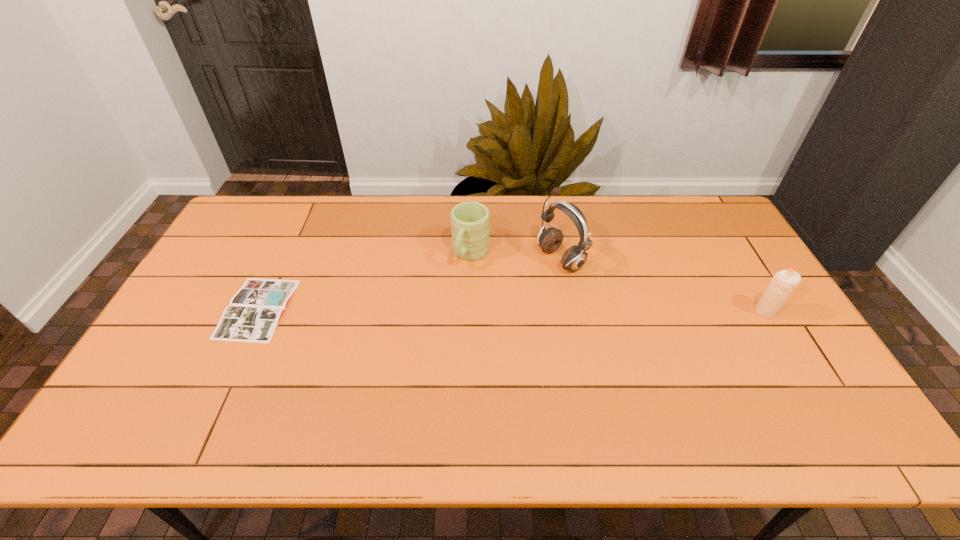
In order to click on free space located on the ear pads of the tallest object in this screenshot , I will do `click(505, 290)`.

At what (x,y) coordinates should I click in order to perform the action: click on blank area located 0.300m on the ear pads of the tallest object. Please return your answer as a coordinate pair (x, y). Image resolution: width=960 pixels, height=540 pixels. Looking at the image, I should click on (464, 312).

Identify the location of free space located 0.210m on the ear pads of the tallest object. (489, 299).

Locate an element on the screen. vacant space located on the side of the second shortest object with the handle is located at coordinates (434, 326).

Locate an element on the screen. blank area located on the side of the second shortest object with the handle is located at coordinates (443, 310).

Find the location of a particular element. This screenshot has width=960, height=540. free point located on the side of the second shortest object with the handle is located at coordinates (457, 285).

You are a GUI agent. You are given a task and a screenshot of the screen. Output one action in this format:
    pyautogui.click(x=<x>, y=<y>)
    Task: Click on the object that is at the left edge
    
    Given the screenshot: What is the action you would take?
    pos(254,312)

The width and height of the screenshot is (960, 540). Find the location of `object that is at the right edge`. object that is at the right edge is located at coordinates (782, 284).

Image resolution: width=960 pixels, height=540 pixels. I want to click on vacant space at the far edge of the desktop, so click(377, 224).

The image size is (960, 540). In the image, there is a desktop. In order to click on vacant space at the near edge in this screenshot , I will do `click(467, 383)`.